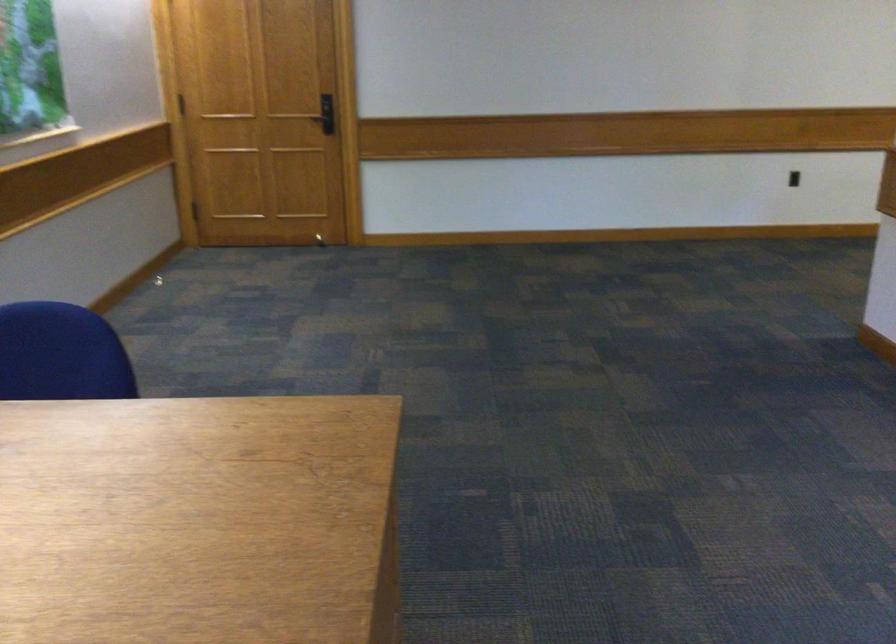
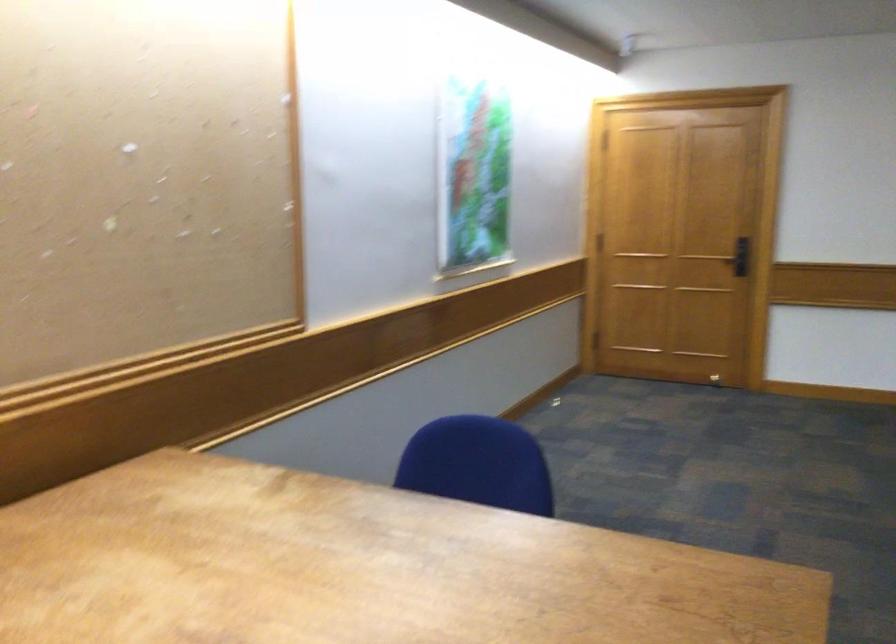
Locate, in the second image, the point that corresponds to [270,90] in the first image.

(681, 230)